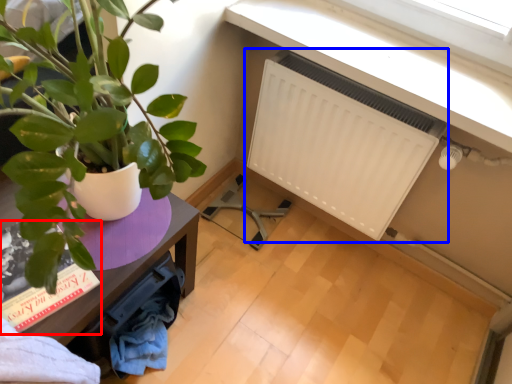
Question: Which object appears farthest to the camera in this image, book (highlighted by a red box) or radiator (highlighted by a blue box)?

Choices:
 (A) book
 (B) radiator

Answer: (B)